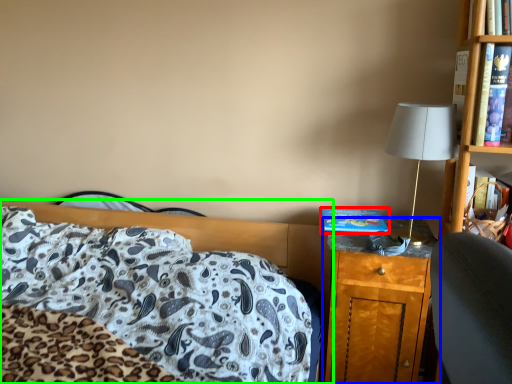
Question: Considering the real-world distances, which object is farthest from hardback book (highlighted by a red box)? nightstand (highlighted by a blue box) or bed (highlighted by a green box)?

Choices:
 (A) nightstand
 (B) bed

Answer: (B)